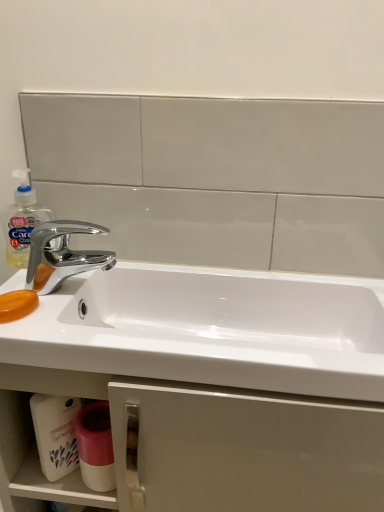
Question: Considering the relative sizes of translucent plastic soap dispenser at left and chrome/metallic faucet at left in the image provided, is translucent plastic soap dispenser at left wider than chrome/metallic faucet at left?

Choices:
 (A) yes
 (B) no

Answer: (B)

Question: From the image's perspective, is translucent plastic soap dispenser at left on top of chrome/metallic faucet at left?

Choices:
 (A) yes
 (B) no

Answer: (A)

Question: Is translucent plastic soap dispenser at left to the left of chrome/metallic faucet at left from the viewer's perspective?

Choices:
 (A) yes
 (B) no

Answer: (A)

Question: Considering the relative sizes of translucent plastic soap dispenser at left and chrome/metallic faucet at left in the image provided, is translucent plastic soap dispenser at left smaller than chrome/metallic faucet at left?

Choices:
 (A) yes
 (B) no

Answer: (A)

Question: From a real-world perspective, is translucent plastic soap dispenser at left located higher than chrome/metallic faucet at left?

Choices:
 (A) no
 (B) yes

Answer: (B)

Question: From a real-world perspective, is translucent plastic soap dispenser at left physically located above or below white matte cabinet at lower center?

Choices:
 (A) above
 (B) below

Answer: (A)

Question: From the image's perspective, is translucent plastic soap dispenser at left above or below white matte cabinet at lower center?

Choices:
 (A) above
 (B) below

Answer: (A)

Question: Would you say translucent plastic soap dispenser at left is to the left or to the right of white matte cabinet at lower center in the picture?

Choices:
 (A) left
 (B) right

Answer: (A)

Question: Considering the positions of translucent plastic soap dispenser at left and white matte cabinet at lower center in the image, is translucent plastic soap dispenser at left wider or thinner than white matte cabinet at lower center?

Choices:
 (A) thin
 (B) wide

Answer: (A)

Question: Considering the positions of white matte cabinet at lower center and white glossy cup at lower center in the image, is white matte cabinet at lower center wider or thinner than white glossy cup at lower center?

Choices:
 (A) wide
 (B) thin

Answer: (A)

Question: Is white matte cabinet at lower center situated inside white glossy cup at lower center or outside?

Choices:
 (A) inside
 (B) outside

Answer: (B)

Question: From a real-world perspective, is white matte cabinet at lower center above or below white glossy cup at lower center?

Choices:
 (A) above
 (B) below

Answer: (B)

Question: Is white matte cabinet at lower center taller or shorter than white glossy cup at lower center?

Choices:
 (A) short
 (B) tall

Answer: (B)

Question: From the image's perspective, is white plastic container at lower left located above or below white matte cabinet at lower center?

Choices:
 (A) above
 (B) below

Answer: (A)

Question: In terms of width, does white plastic container at lower left look wider or thinner when compared to white matte cabinet at lower center?

Choices:
 (A) wide
 (B) thin

Answer: (B)